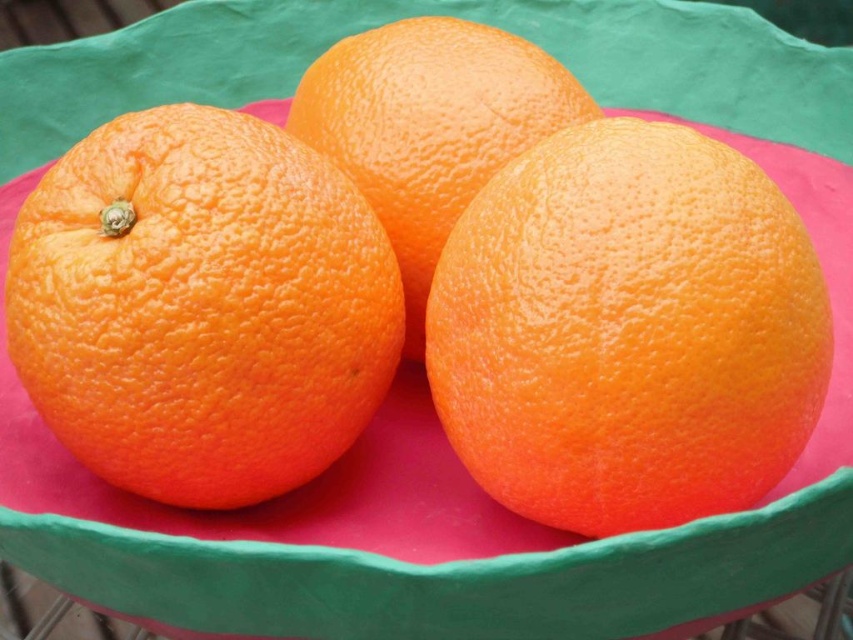
Between point (222, 204) and point (434, 120), which one is positioned behind?

The point (434, 120) is behind.

Can you confirm if orangetexturedorange at left is thinner than orangetexturedorange at center?

Incorrect, orangetexturedorange at left's width is not less than orangetexturedorange at center's.

Where is `orangetexturedorange at left`? The image size is (853, 640). orangetexturedorange at left is located at coordinates (201, 307).

Does orangesmoothorange at center have a lesser width compared to orangetexturedorange at left?

Yes, orangesmoothorange at center is thinner than orangetexturedorange at left.

Which of these two, orangesmoothorange at center or orangetexturedorange at left, stands taller?

orangetexturedorange at left

Where is `orangesmoothorange at center`? The height and width of the screenshot is (640, 853). orangesmoothorange at center is located at coordinates (628, 330).

Where is `orangesmoothorange at center`? Image resolution: width=853 pixels, height=640 pixels. orangesmoothorange at center is located at coordinates (628, 330).

Does point (498, 422) lie in front of point (453, 40)?

Yes, it is in front of point (453, 40).

Based on the photo, can you confirm if orangesmoothorange at center is shorter than orangetexturedorange at center?

Yes, orangesmoothorange at center is shorter than orangetexturedorange at center.

Does point (440, 372) lie in front of point (505, 116)?

Yes, point (440, 372) is in front of point (505, 116).

Find the location of a particular element. orangesmoothorange at center is located at coordinates (628, 330).